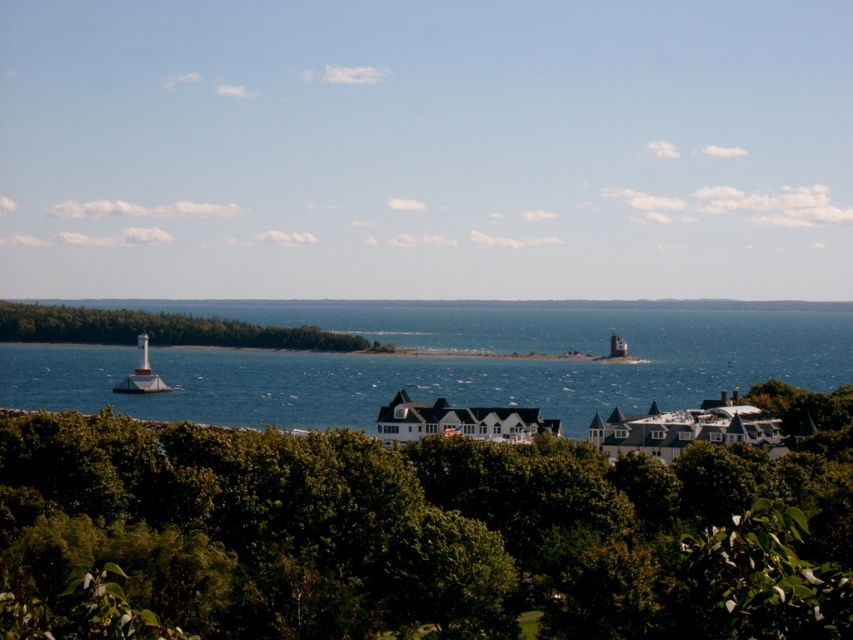
Question: Considering the real-world distances, which object is farthest from the blue water at center?

Choices:
 (A) white painted wood lighthouse at left
 (B) green leafy tree at lower center
 (C) green leafy tree at left

Answer: (B)

Question: Which of these objects is positioned farthest from the green leafy tree at lower center?

Choices:
 (A) white painted wood lighthouse at left
 (B) green leafy tree at left
 (C) blue water at center

Answer: (B)

Question: Which object is the farthest from the green leafy tree at left?

Choices:
 (A) blue water at center
 (B) white painted wood lighthouse at left

Answer: (B)

Question: Can you confirm if blue water at center is positioned to the right of green leafy tree at left?

Choices:
 (A) yes
 (B) no

Answer: (A)

Question: Is green leafy tree at lower center below blue water at center?

Choices:
 (A) no
 (B) yes

Answer: (B)

Question: Can you confirm if green leafy tree at lower center is positioned above green leafy tree at left?

Choices:
 (A) no
 (B) yes

Answer: (A)